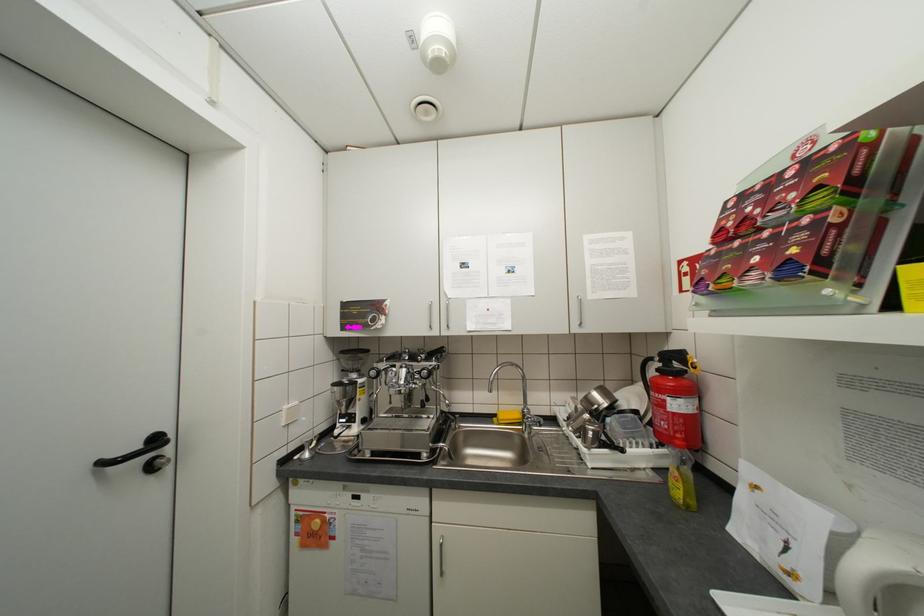
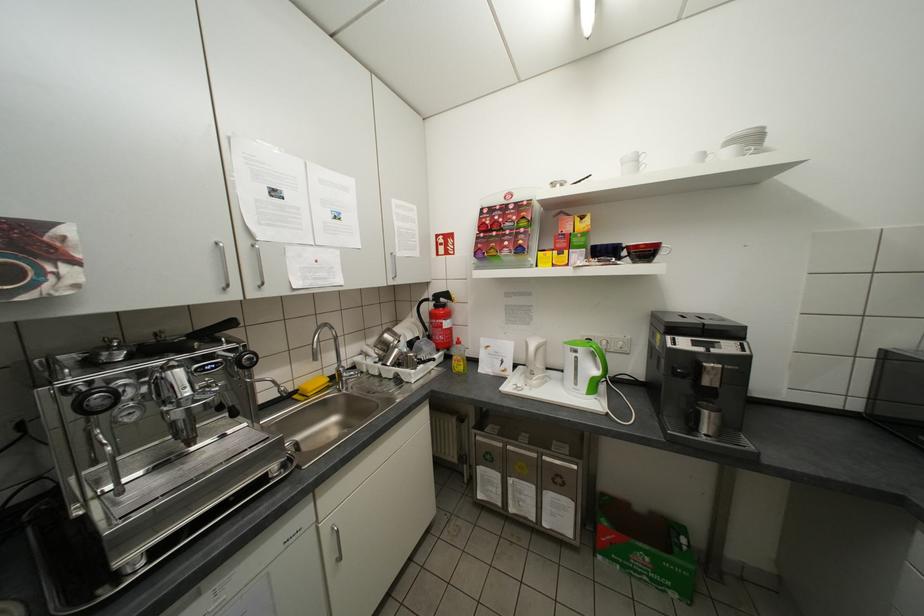
Find the pixel in the second image that matches pixel 509 418 in the first image.

(319, 389)